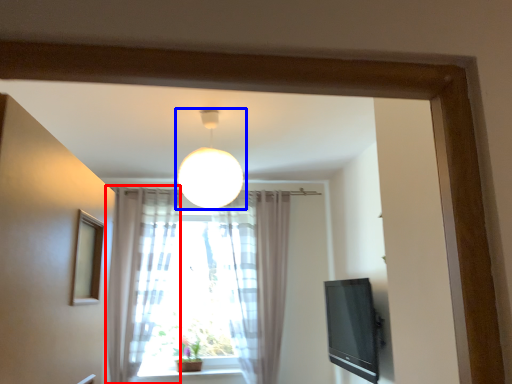
Question: Which point is further to the camera, curtain (highlighted by a red box) or lamp (highlighted by a blue box)?

Choices:
 (A) curtain
 (B) lamp

Answer: (A)